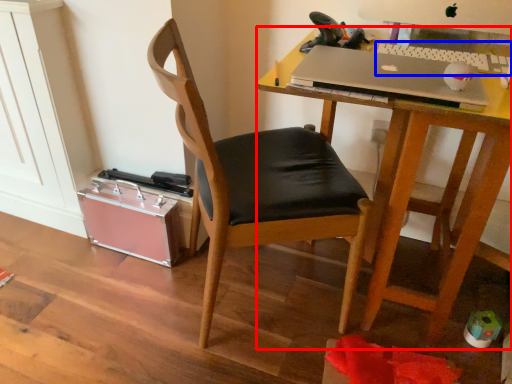
Question: Which of the following is the farthest to the observer, desk (highlighted by a red box) or laptop keyboard (highlighted by a blue box)?

Choices:
 (A) desk
 (B) laptop keyboard

Answer: (B)